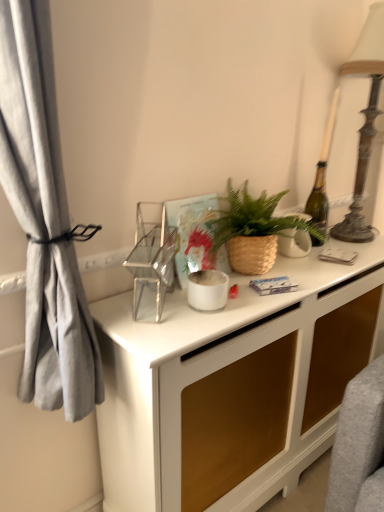
You are a GUI agent. You are given a task and a screenshot of the screen. Output one action in this format:
    pyautogui.click(x=<x>, y=<y>)
    Task: Click on the vacant space situated on the left part of white matte pot at center, acting as the 2th appliance starting from the left
    
    Given the screenshot: What is the action you would take?
    pyautogui.click(x=144, y=312)